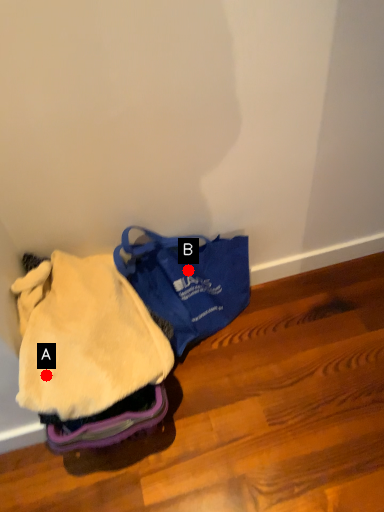
Question: Two points are circled on the image, labeled by A and B beside each circle. Which point appears closest to the camera in this image?

Choices:
 (A) A is closer
 (B) B is closer

Answer: (A)